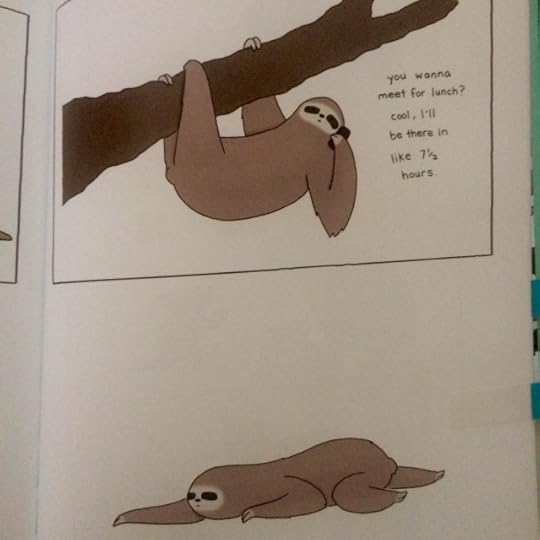
This screenshot has width=540, height=540. I want to click on corner of room, so click(45, 394).